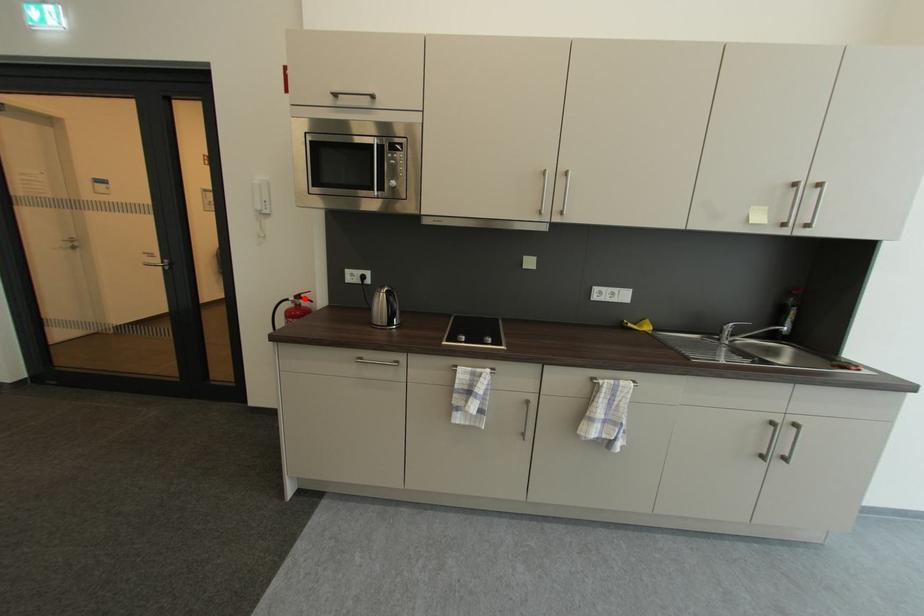
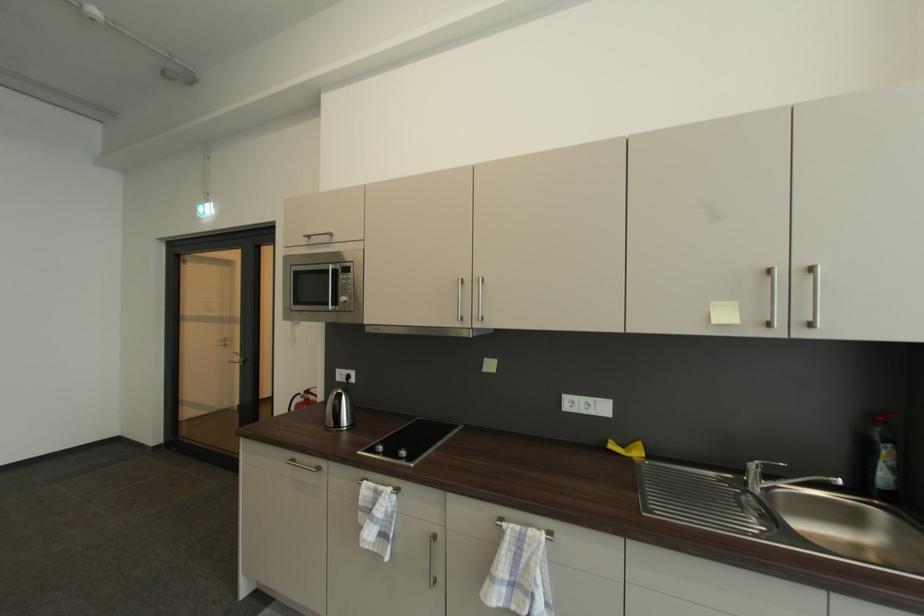
Locate, in the second image, the point that corresponds to the highlighted location in the first image.

(314, 392)